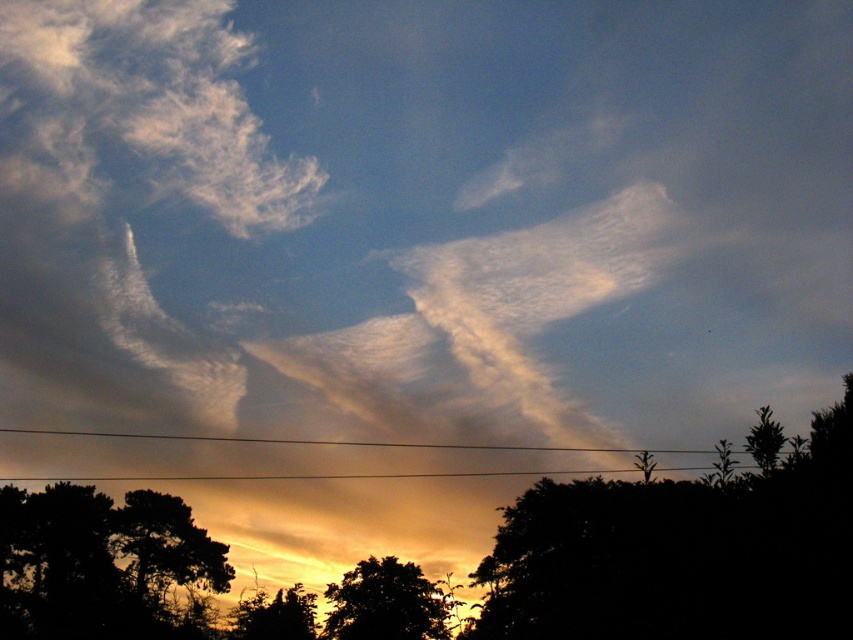
Question: Does silhouette tree at lower center have a smaller size compared to metallic wire at bottom center?

Choices:
 (A) no
 (B) yes

Answer: (B)

Question: Which object is farther from the camera taking this photo?

Choices:
 (A) black silhouetted tree at lower left
 (B) silhouette tree at lower left
 (C) silhouette leafy tree at lower right
 (D) silhouette leafy tree at lower center

Answer: (B)

Question: Estimate the real-world distances between objects in this image. Which object is farther from the black silhouetted tree at lower left?

Choices:
 (A) silhouette tree at lower center
 (B) silhouette tree at lower left

Answer: (A)

Question: Is silhouette tree at lower center bigger than metallic wire at bottom center?

Choices:
 (A) no
 (B) yes

Answer: (A)

Question: Does black silhouetted tree at lower left appear on the right side of silhouette tree at lower left?

Choices:
 (A) yes
 (B) no

Answer: (B)

Question: Which point appears closest to the camera in this image?

Choices:
 (A) (190, 557)
 (B) (283, 442)
 (C) (263, 600)
 (D) (132, 502)

Answer: (C)